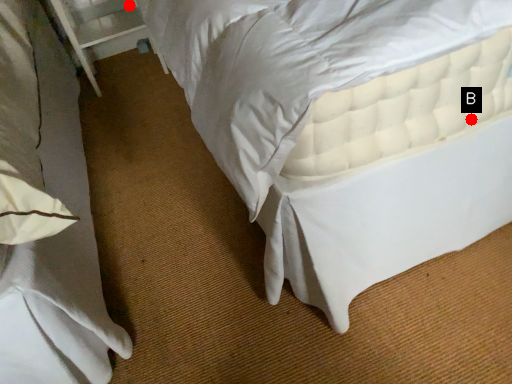
Question: Two points are circled on the image, labeled by A and B beside each circle. Which of the following is the closest to the observer?

Choices:
 (A) A is closer
 (B) B is closer

Answer: (B)